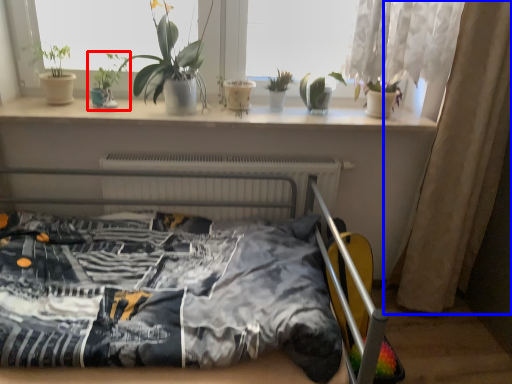
Question: Which object is further to the camera taking this photo, houseplant (highlighted by a red box) or curtain (highlighted by a blue box)?

Choices:
 (A) houseplant
 (B) curtain

Answer: (A)